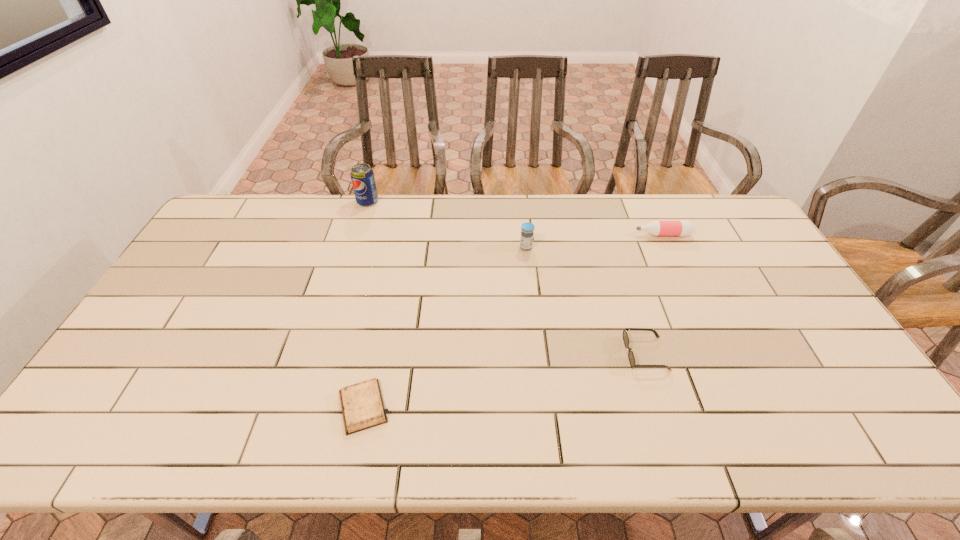
Locate an element on the screen. This screenshot has height=540, width=960. bottle that is at the far edge is located at coordinates (682, 228).

At what (x,y) coordinates should I click in order to perform the action: click on object present at the near edge. Please return your answer as a coordinate pair (x, y). This screenshot has height=540, width=960. Looking at the image, I should click on (362, 405).

This screenshot has width=960, height=540. Identify the location of vacant region at the far edge of the desktop. (315, 230).

Locate an element on the screen. Image resolution: width=960 pixels, height=540 pixels. vacant area at the near edge of the desktop is located at coordinates (619, 417).

The width and height of the screenshot is (960, 540). I want to click on vacant space at the left edge, so click(164, 371).

In the image, there is a desktop. What are the coordinates of `vacant space at the right edge` in the screenshot? It's located at (742, 252).

In the image, there is a desktop. Where is `vacant space at the far left corner`? This screenshot has width=960, height=540. vacant space at the far left corner is located at coordinates 241,205.

The width and height of the screenshot is (960, 540). Identify the location of free space at the near left corner. (89, 431).

The image size is (960, 540). Find the location of `vacant space at the near right corner`. vacant space at the near right corner is located at coordinates point(852,419).

Identify the location of unoccupied area between the third tallest object and the fourth shortest object. Image resolution: width=960 pixels, height=540 pixels. (594, 241).